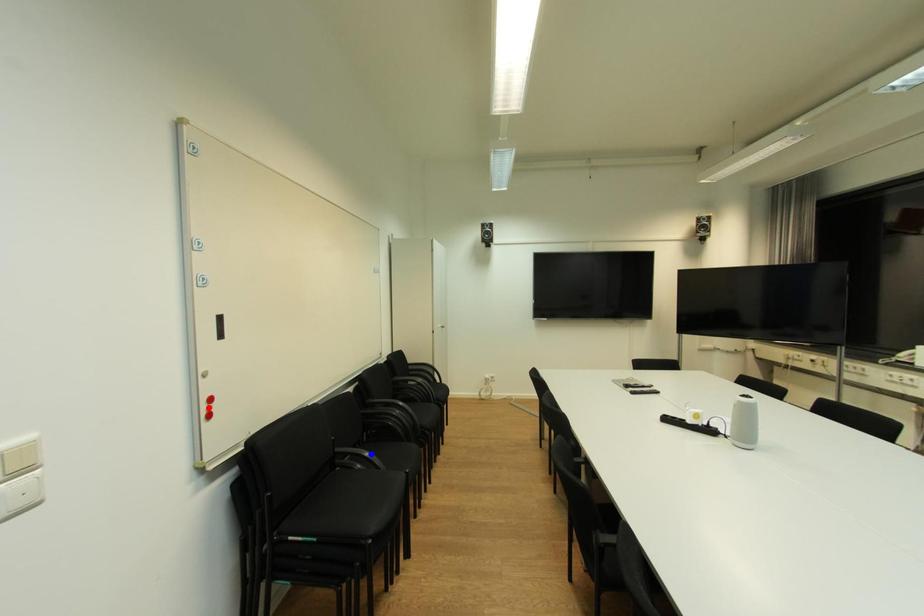
Question: Which of the two points in the image is closer to the camera?

Choices:
 (A) Blue point is closer.
 (B) Red point is closer.

Answer: (B)